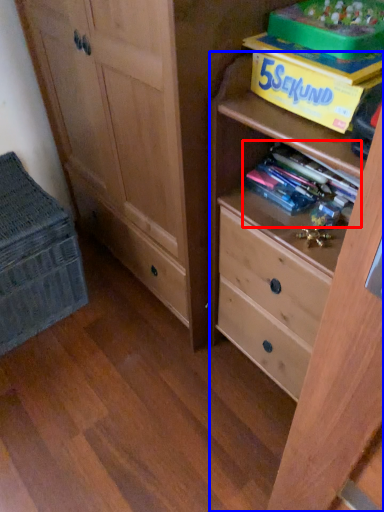
Question: Which of the following is the closest to the observer, book (highlighted by a red box) or chest of drawers (highlighted by a blue box)?

Choices:
 (A) book
 (B) chest of drawers

Answer: (B)